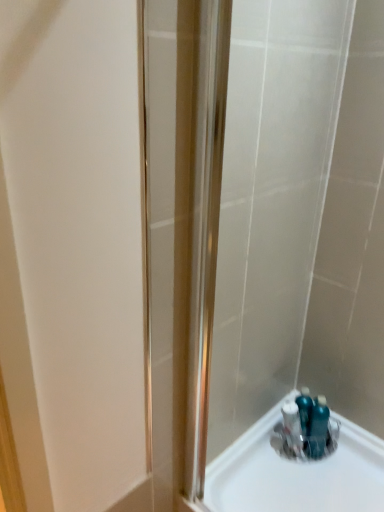
Locate an element on the screen. blank area to the left of blue glossy bottles at bottom right, the 2th sink in the left-to-right sequence is located at coordinates (276, 461).